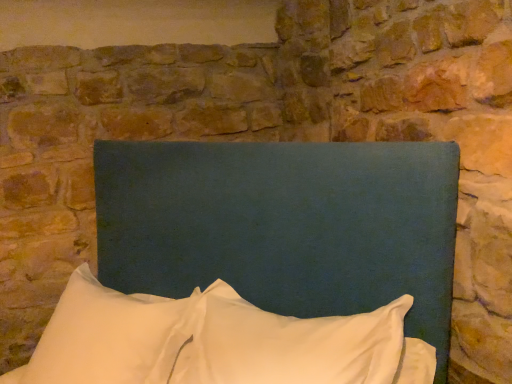
Question: In terms of height, does teal fabric headboard at center look taller or shorter compared to white soft pillow at center, which is the first pillow from right to left?

Choices:
 (A) short
 (B) tall

Answer: (B)

Question: Would you say teal fabric headboard at center is inside or outside white soft pillow at center, the 2th pillow when ordered from left to right?

Choices:
 (A) outside
 (B) inside

Answer: (A)

Question: Which object is the closest to the white soft pillow at lower left, arranged as the first pillow when viewed from the left?

Choices:
 (A) white soft pillow at center, the 2th pillow when ordered from left to right
 (B) teal fabric headboard at center

Answer: (A)

Question: Which object is positioned farthest from the teal fabric headboard at center?

Choices:
 (A) white soft pillow at center, the 2th pillow when ordered from left to right
 (B) white soft pillow at lower left, arranged as the first pillow when viewed from the left

Answer: (B)